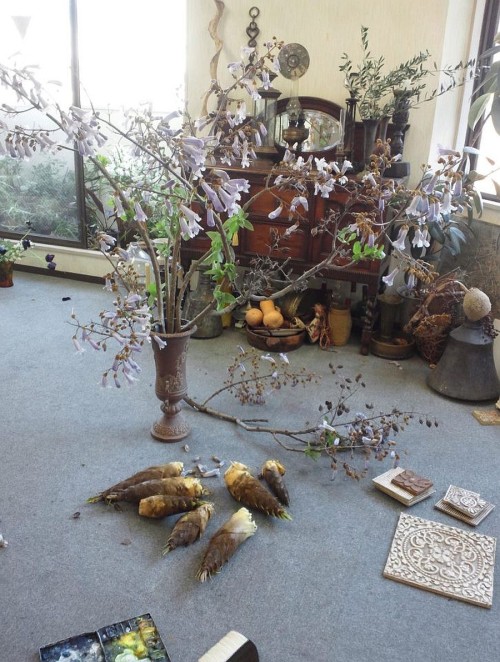
Identify the location of mirror attached to credenza. (321, 128).